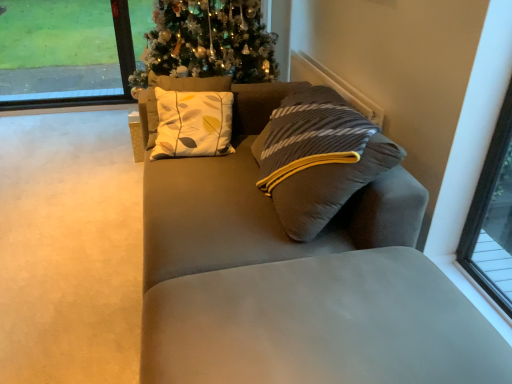
Question: From the image's perspective, is suede gray couch at center located beneath beige carpet at lower left?

Choices:
 (A) yes
 (B) no

Answer: (B)

Question: Can you confirm if suede gray couch at center is taller than beige carpet at lower left?

Choices:
 (A) no
 (B) yes

Answer: (B)

Question: Can you confirm if suede gray couch at center is smaller than beige carpet at lower left?

Choices:
 (A) no
 (B) yes

Answer: (A)

Question: Does suede gray couch at center appear on the right side of beige carpet at lower left?

Choices:
 (A) no
 (B) yes

Answer: (B)

Question: Is suede gray couch at center positioned with its back to beige carpet at lower left?

Choices:
 (A) no
 (B) yes

Answer: (A)

Question: Is suede gray couch at center to the left of beige carpet at lower left from the viewer's perspective?

Choices:
 (A) yes
 (B) no

Answer: (B)

Question: Are beige carpet at lower left and suede gray couch at center making contact?

Choices:
 (A) yes
 (B) no

Answer: (B)

Question: Does beige carpet at lower left appear on the right side of suede gray couch at center?

Choices:
 (A) no
 (B) yes

Answer: (A)

Question: Would you consider beige carpet at lower left to be distant from suede gray couch at center?

Choices:
 (A) yes
 (B) no

Answer: (B)

Question: Considering the relative sizes of beige carpet at lower left and suede gray couch at center in the image provided, is beige carpet at lower left smaller than suede gray couch at center?

Choices:
 (A) yes
 (B) no

Answer: (A)

Question: Does beige carpet at lower left have a lesser width compared to suede gray couch at center?

Choices:
 (A) yes
 (B) no

Answer: (B)

Question: Does beige carpet at lower left turn towards suede gray couch at center?

Choices:
 (A) yes
 (B) no

Answer: (B)

Question: Considering the relative sizes of transparent glass window at upper left and suede gray couch at center in the image provided, is transparent glass window at upper left taller than suede gray couch at center?

Choices:
 (A) yes
 (B) no

Answer: (A)